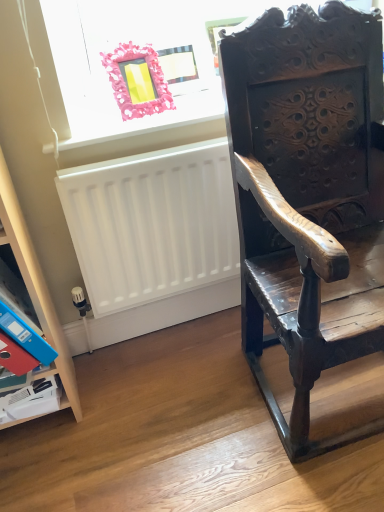
You are a GUI agent. You are given a task and a screenshot of the screen. Output one action in this format:
    pyautogui.click(x=<x>, y=<y>)
    Task: Click on the vacant space situated on the left part of pink fabric picture frame at upper left
    The height and width of the screenshot is (512, 384).
    Given the screenshot: What is the action you would take?
    pyautogui.click(x=99, y=113)